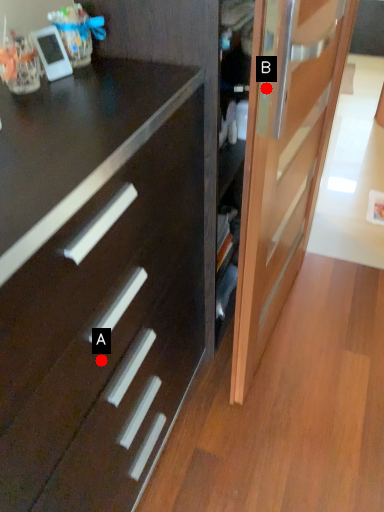
Question: Two points are circled on the image, labeled by A and B beside each circle. Which point is farther to the camera?

Choices:
 (A) A is further
 (B) B is further

Answer: (A)